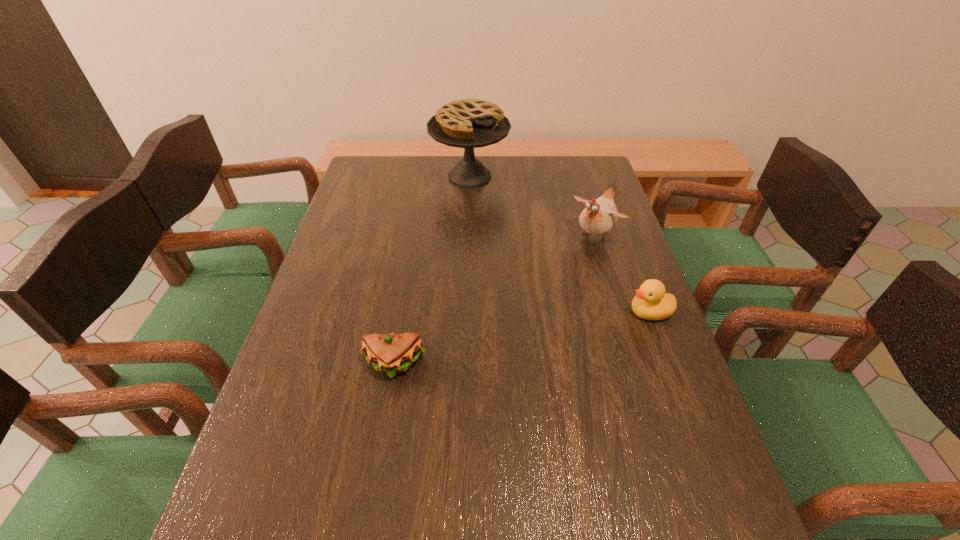
You are a GUI agent. You are given a task and a screenshot of the screen. Output one action in this format:
    pyautogui.click(x=<x>, y=<y>)
    Task: Click on the free space located at the beak of the second farthest object
    The height and width of the screenshot is (540, 960).
    Given the screenshot: What is the action you would take?
    pyautogui.click(x=526, y=306)

The height and width of the screenshot is (540, 960). What are the coordinates of `vacant space located at the beak of the second farthest object` in the screenshot? It's located at (530, 301).

This screenshot has height=540, width=960. I want to click on free space located at the beak of the second farthest object, so click(x=550, y=280).

This screenshot has height=540, width=960. What are the coordinates of `free space located on the cut side of the pie` in the screenshot? It's located at [x=497, y=221].

Identify the location of free region located on the cut side of the pie. The image size is (960, 540). tap(503, 230).

This screenshot has width=960, height=540. Identify the location of free space located on the cut side of the pie. point(529,272).

Find the location of `object that is at the far edge`. object that is at the far edge is located at coordinates (468, 123).

Where is `duckling that is at the right edge`? duckling that is at the right edge is located at coordinates (650, 302).

This screenshot has height=540, width=960. I want to click on bird that is at the right edge, so click(600, 216).

Image resolution: width=960 pixels, height=540 pixels. Identify the location of vacant region at the far edge of the desktop. (456, 190).